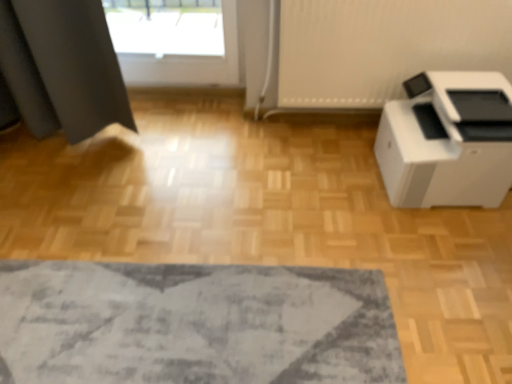
Identify the location of vacant area on the back side of textured gray rug at lower center. This screenshot has width=512, height=384. (232, 201).